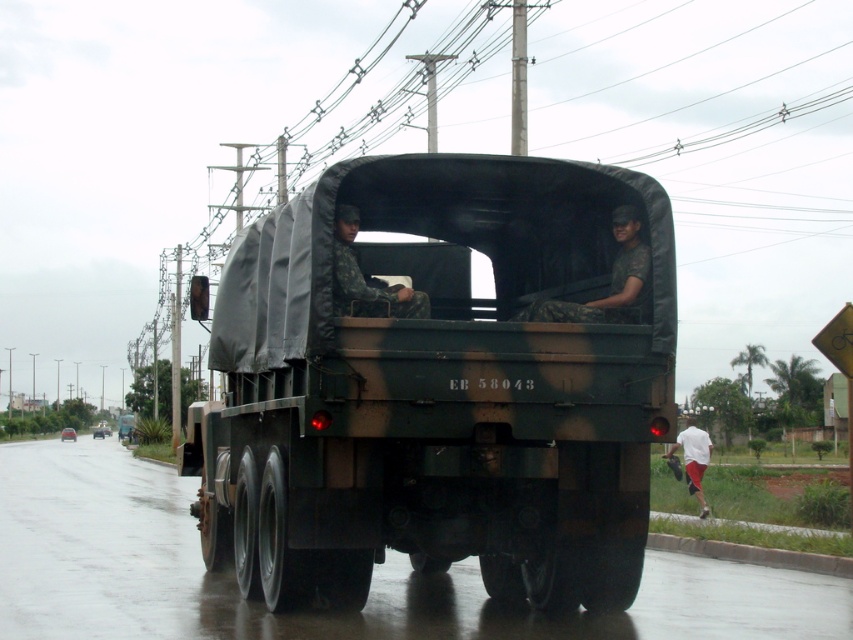
Question: Based on their relative distances, which object is farther from the camouflage fabric uniform at center?

Choices:
 (A) white cotton shirt at lower right
 (B) camouflage fabric uniform at rear

Answer: (A)

Question: Which of the following is the closest to the observer?

Choices:
 (A) (347, 291)
 (B) (705, 508)
 (C) (640, 308)

Answer: (A)

Question: Which object is the farthest from the camouflage fabric uniform at center?

Choices:
 (A) white cotton shirt at lower right
 (B) camouflage fabric truck at center
 (C) camouflage fabric uniform at rear

Answer: (A)

Question: Is the position of camouflage fabric uniform at rear less distant than that of camouflage fabric uniform at center?

Choices:
 (A) yes
 (B) no

Answer: (B)

Question: Does camouflage fabric uniform at rear appear on the left side of white cotton shirt at lower right?

Choices:
 (A) no
 (B) yes

Answer: (B)

Question: Where is camouflage fabric uniform at center located in relation to white cotton shirt at lower right in the image?

Choices:
 (A) above
 (B) below

Answer: (A)